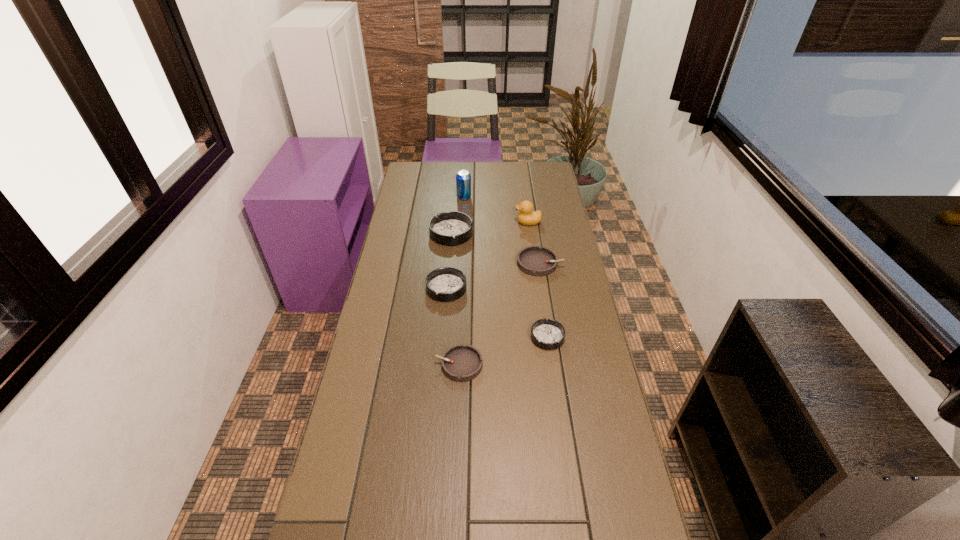
Find the location of a particular element. the farthest object is located at coordinates (463, 179).

Image resolution: width=960 pixels, height=540 pixels. I want to click on blue beer can, so click(463, 179).

Locate an element on the screen. duckling is located at coordinates (526, 216).

In order to click on the farthest ashtray in this screenshot , I will do `click(450, 228)`.

Find the location of a particular element. the biggest dark ashtray is located at coordinates (450, 228).

This screenshot has height=540, width=960. Identify the location of the farther gray ashtray. (533, 260).

I want to click on the bigger gray ashtray, so click(x=533, y=260).

This screenshot has width=960, height=540. I want to click on the second biggest dark ashtray, so click(x=445, y=284).

You are a GUI agent. You are given a task and a screenshot of the screen. Output one action in this format:
    pyautogui.click(x=<x>, y=<y>)
    Task: Click on the smaller gray ashtray
    
    Given the screenshot: What is the action you would take?
    pyautogui.click(x=461, y=362)

What are the coordinates of `the left gray ashtray` in the screenshot? It's located at (461, 362).